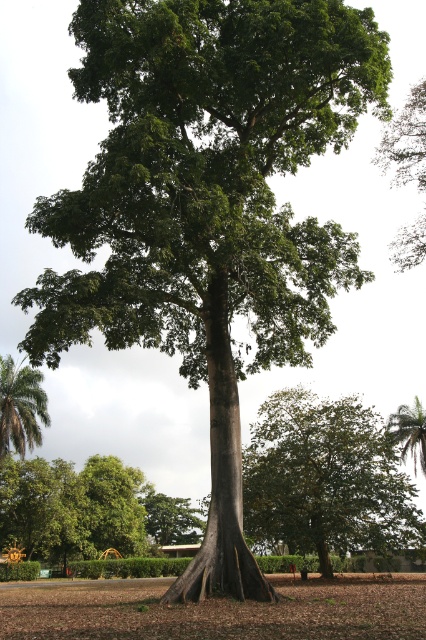
Measure the distance between brown dry soil at center and green leafy palm tree at upper right.

They are 100.90 feet apart.

Is brown dry soil at center smaller than green leafy palm tree at upper right?

Incorrect, brown dry soil at center is not smaller in size than green leafy palm tree at upper right.

The width and height of the screenshot is (426, 640). What do you see at coordinates (215, 611) in the screenshot?
I see `brown dry soil at center` at bounding box center [215, 611].

Where is `brown dry soil at center`? brown dry soil at center is located at coordinates (215, 611).

Who is lower down, green leafy tree at upper right or green leafy palm tree at upper right?

green leafy palm tree at upper right

Is green leafy tree at upper right below green leafy palm tree at upper right?

Incorrect, green leafy tree at upper right is not positioned below green leafy palm tree at upper right.

Does point (420, 104) come in front of point (391, 433)?

That is True.

Identify the location of green leafy tree at upper right. (405, 141).

This screenshot has height=640, width=426. Find the location of `green leafy palm tree at lower left`. green leafy palm tree at lower left is located at coordinates point(20,406).

Can you confirm if green leafy palm tree at lower left is positioned to the right of green leafy palm tree at upper right?

No, green leafy palm tree at lower left is not to the right of green leafy palm tree at upper right.

Is point (40, 387) closer to camera compared to point (394, 412)?

No, it is behind (394, 412).

The width and height of the screenshot is (426, 640). Identify the location of green leafy palm tree at lower left. (20, 406).